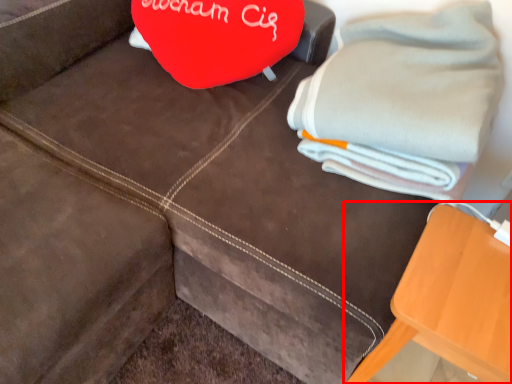
Question: Considering the relative positions of furniture (annotated by the red box) and bath towel in the image provided, where is furniture (annotated by the red box) located with respect to the staircase?

Choices:
 (A) right
 (B) left

Answer: (A)